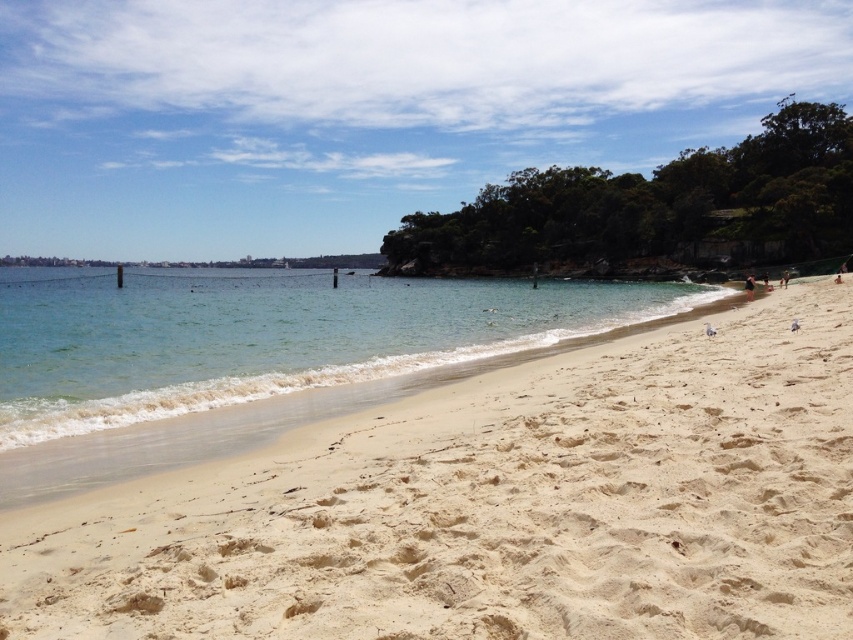
In the scene shown: Does black fabric person at lower right have a greater height compared to light brown sand at upper right?

Correct, black fabric person at lower right is much taller as light brown sand at upper right.

Does black fabric person at lower right appear over light brown sand at upper right?

Incorrect, black fabric person at lower right is not positioned above light brown sand at upper right.

Based on the photo, measure the distance between black fabric person at lower right and camera.

They are 42.31 meters apart.

Where is `black fabric person at lower right`? This screenshot has width=853, height=640. black fabric person at lower right is located at coordinates (749, 285).

Between clear water at beach center and light brown sand at upper right, which one is positioned higher?

clear water at beach center is above.

This screenshot has width=853, height=640. In order to click on clear water at beach center in this screenshot , I will do `click(265, 336)`.

Between point (80, 358) and point (782, 273), which one is positioned behind?

Point (782, 273)

Locate an element on the screen. clear water at beach center is located at coordinates (265, 336).

Is light beige sand at lower center further to camera compared to black fabric person at lower right?

No, it is in front of black fabric person at lower right.

In the scene shown: Between light beige sand at lower center and black fabric person at lower right, which one is positioned higher?

black fabric person at lower right is higher up.

I want to click on light beige sand at lower center, so click(x=496, y=506).

Identify the location of light beige sand at lower center. Image resolution: width=853 pixels, height=640 pixels. (496, 506).